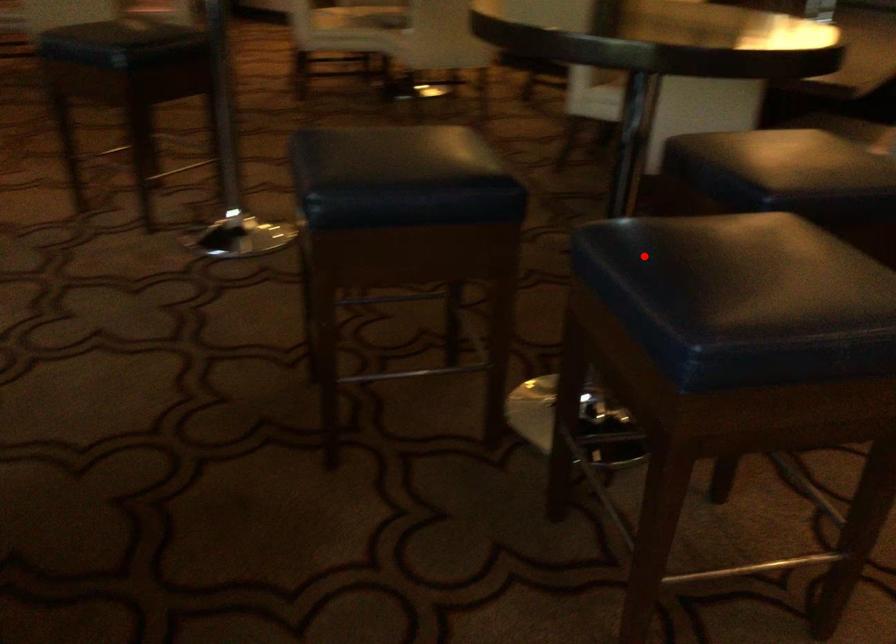
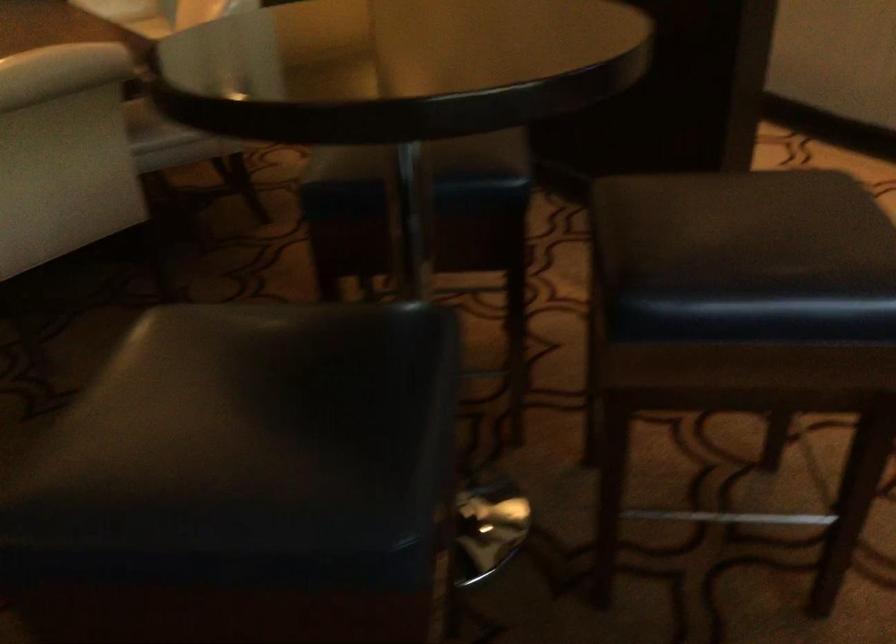
Locate, in the second image, the point that corresponds to the highlighted location in the first image.

(745, 257)